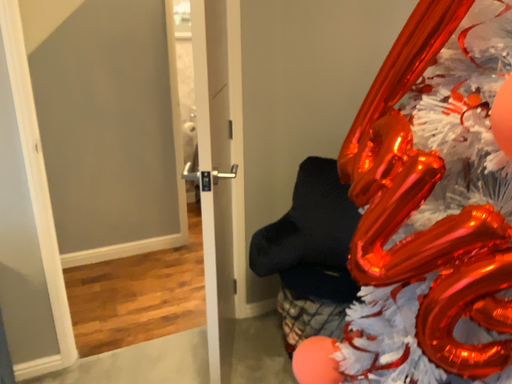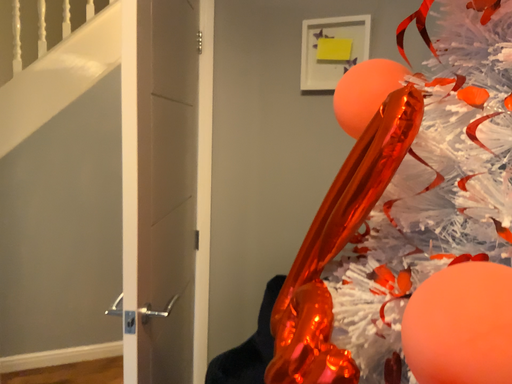
Question: How did the camera likely rotate when shooting the video?

Choices:
 (A) rotated upward
 (B) rotated downward

Answer: (A)